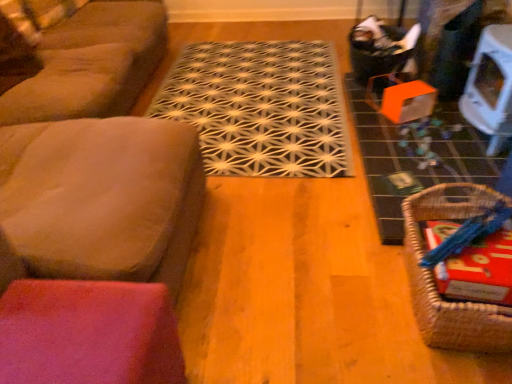
Locate an element on the screen. vacant space underneath black woven mat at center (from a real-world perspective) is located at coordinates (275, 95).